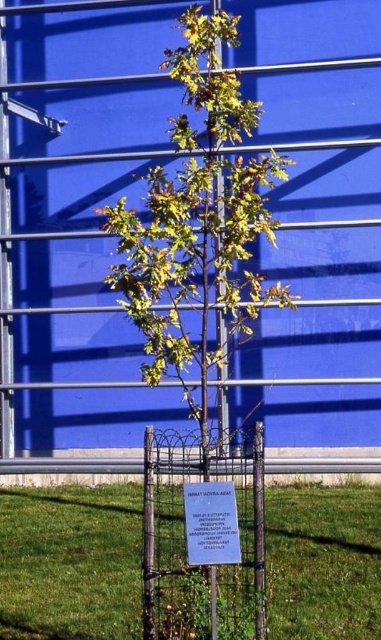
Based on the photo, which is above, green leafy tree at center or green grass at lower center?

green leafy tree at center is higher up.

Is green leafy tree at center in front of green grass at lower center?

Yes, it is in front of green grass at lower center.

Describe the element at coordinates (198, 227) in the screenshot. The image size is (381, 640). I see `green leafy tree at center` at that location.

Locate an element on the screen. green leafy tree at center is located at coordinates (198, 227).

From the picture: Is green leafy tree at center bigger than wire mesh fence at lower center?

Yes, green leafy tree at center is bigger than wire mesh fence at lower center.

What are the coordinates of `green leafy tree at center` in the screenshot? It's located at (198, 227).

Can you confirm if green grass at lower center is positioned to the left of wire mesh fence at lower center?

Correct, you'll find green grass at lower center to the left of wire mesh fence at lower center.

Does green grass at lower center have a larger size compared to wire mesh fence at lower center?

Yes.

The width and height of the screenshot is (381, 640). What are the coordinates of `green grass at lower center` in the screenshot? It's located at (70, 563).